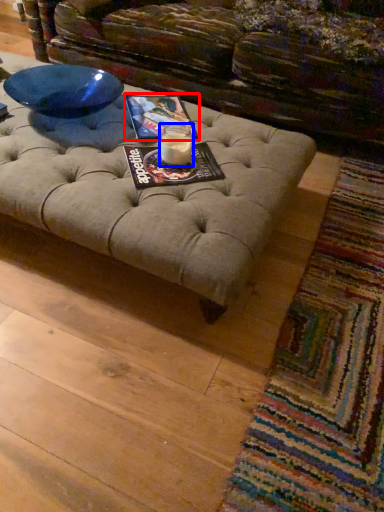
Question: Which of the following is the closest to the observer, magazine (highlighted by a red box) or candle holder (highlighted by a blue box)?

Choices:
 (A) magazine
 (B) candle holder

Answer: (B)